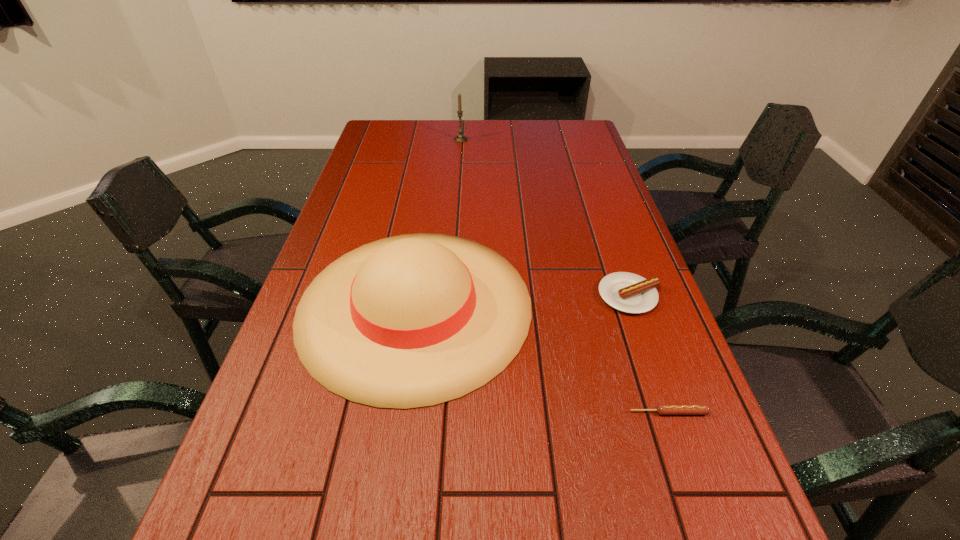
The height and width of the screenshot is (540, 960). Identify the location of the farthest object. pos(460,138).

Where is `sombrero`? sombrero is located at coordinates (414, 320).

This screenshot has width=960, height=540. In order to click on the second shortest object in this screenshot , I will do `click(627, 292)`.

The height and width of the screenshot is (540, 960). I want to click on the farther sausage, so click(627, 292).

Identify the location of the shorter sausage. The height and width of the screenshot is (540, 960). (661, 409).

Locate an element on the screen. This screenshot has height=540, width=960. the nearer sausage is located at coordinates (661, 409).

What are the coordinates of `free spot located 0.090m on the left of the candle` in the screenshot? It's located at (431, 139).

The image size is (960, 540). What are the coordinates of `free region located 0.080m on the front of the sombrero` in the screenshot? It's located at (394, 449).

This screenshot has width=960, height=540. Identify the location of blank space located on the front of the farther sausage. (695, 488).

At what (x,y) coordinates should I click in order to perform the action: click on vacant space located on the front of the shortest object. Please return your answer as a coordinate pair (x, y). Looking at the image, I should click on (705, 517).